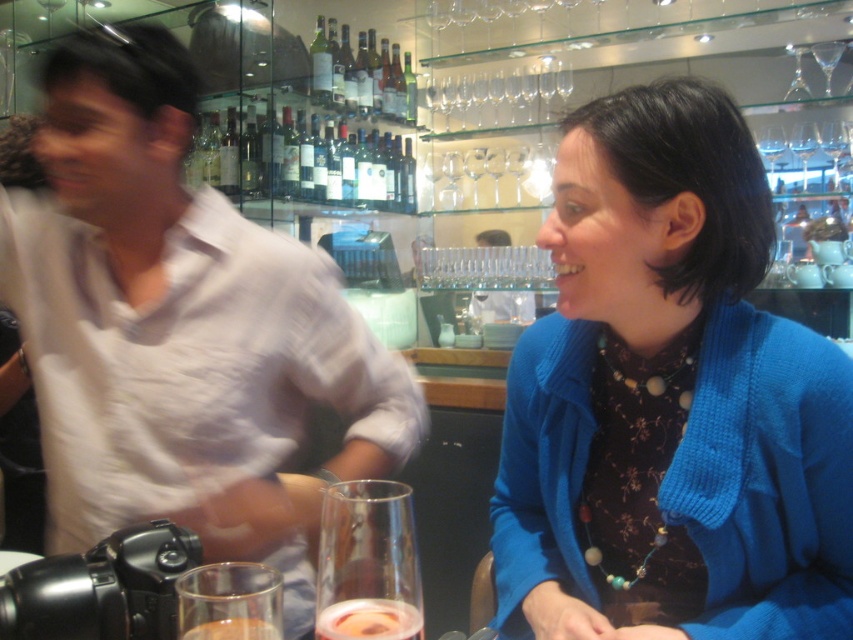
Does blue knitted cardigan at upper right have a smaller size compared to translucent glass wine at center?

Actually, blue knitted cardigan at upper right might be larger than translucent glass wine at center.

Is blue knitted cardigan at upper right shorter than translucent glass wine at center?

No.

You are a GUI agent. You are given a task and a screenshot of the screen. Output one action in this format:
    pyautogui.click(x=<x>, y=<y>)
    Task: Click on the blue knitted cardigan at upper right
    
    Given the screenshot: What is the action you would take?
    pyautogui.click(x=669, y=401)

Locate an element on the screen. Image resolution: width=853 pixels, height=640 pixels. blue knitted cardigan at upper right is located at coordinates (669, 401).

Based on the photo, is translucent glass wine bottle at center positioned at the back of translucent glass wine at center?

Yes, it is.

Between point (341, 164) and point (358, 598), which one is positioned behind?

The point (341, 164) is behind.

Where is `translucent glass wine bottle at center`? The width and height of the screenshot is (853, 640). translucent glass wine bottle at center is located at coordinates (303, 161).

The image size is (853, 640). Describe the element at coordinates (180, 328) in the screenshot. I see `white cotton shirt at left` at that location.

Does white cotton shirt at left appear on the left side of clear glass at lower left?

Correct, you'll find white cotton shirt at left to the left of clear glass at lower left.

Where is `white cotton shirt at left`? The width and height of the screenshot is (853, 640). white cotton shirt at left is located at coordinates (180, 328).